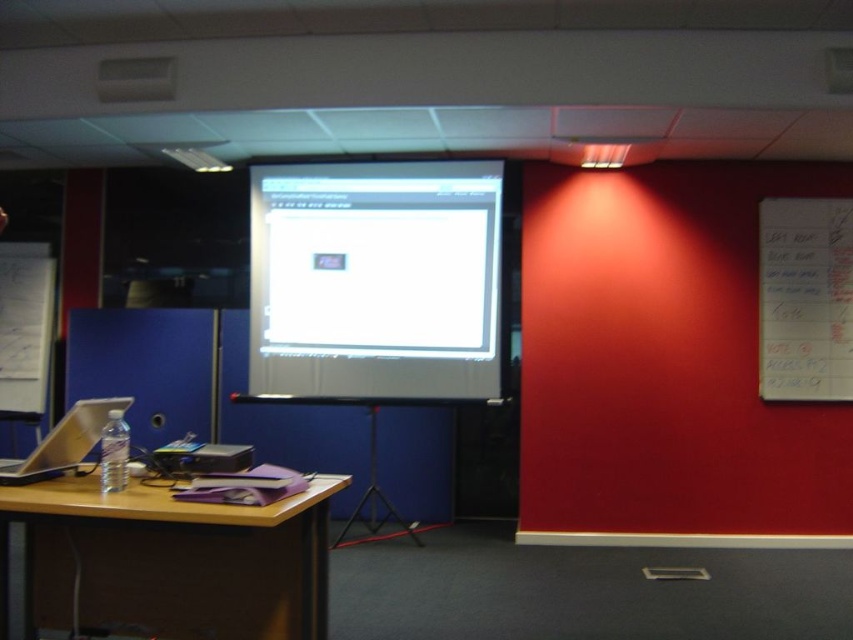
Is point (401, 316) closer to viewer compared to point (300, 572)?

No, (401, 316) is behind (300, 572).

Describe the element at coordinates (375, 280) in the screenshot. I see `white glossy projector screen at center` at that location.

Locate an element on the screen. This screenshot has width=853, height=640. white glossy projector screen at center is located at coordinates (375, 280).

Describe the element at coordinates (375, 280) in the screenshot. I see `white glossy projector screen at center` at that location.

Which is in front, point (303, 324) or point (22, 481)?

Point (22, 481)

Who is more distant from viewer, (339, 316) or (122, 408)?

Point (339, 316)

What are the coordinates of `white glossy projector screen at center` in the screenshot? It's located at coord(375,280).

Can you confirm if white paper at upper right is positioned to the left of matte silver laptop at left?

No, white paper at upper right is not to the left of matte silver laptop at left.

Is white paper at upper right wider than matte silver laptop at left?

Indeed, white paper at upper right has a greater width compared to matte silver laptop at left.

Image resolution: width=853 pixels, height=640 pixels. Identify the location of white paper at upper right. (805, 300).

Where is `white paper at upper right`? white paper at upper right is located at coordinates (805, 300).